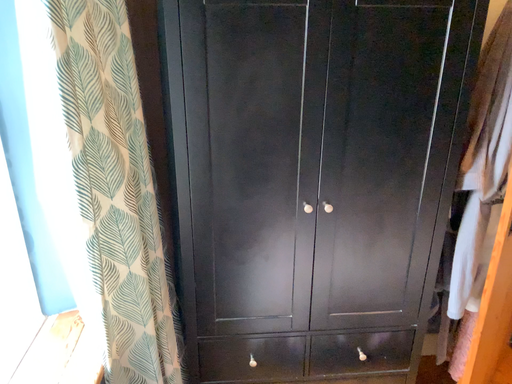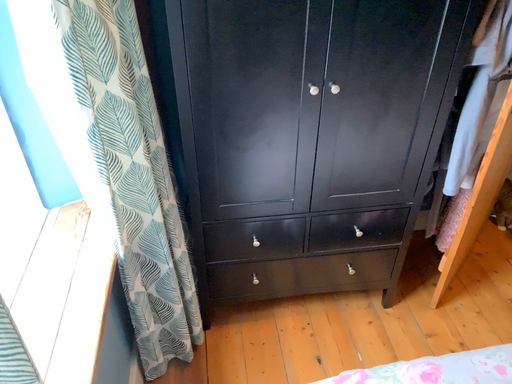
Question: How did the camera likely rotate when shooting the video?

Choices:
 (A) rotated downward
 (B) rotated upward

Answer: (A)